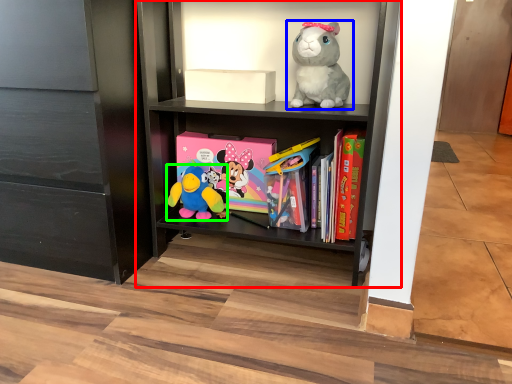
Question: Estimate the real-world distances between objects in this image. Which object is farther from shelf (highlighted by a red box), toy (highlighted by a blue box) or toy (highlighted by a green box)?

Choices:
 (A) toy
 (B) toy

Answer: (B)